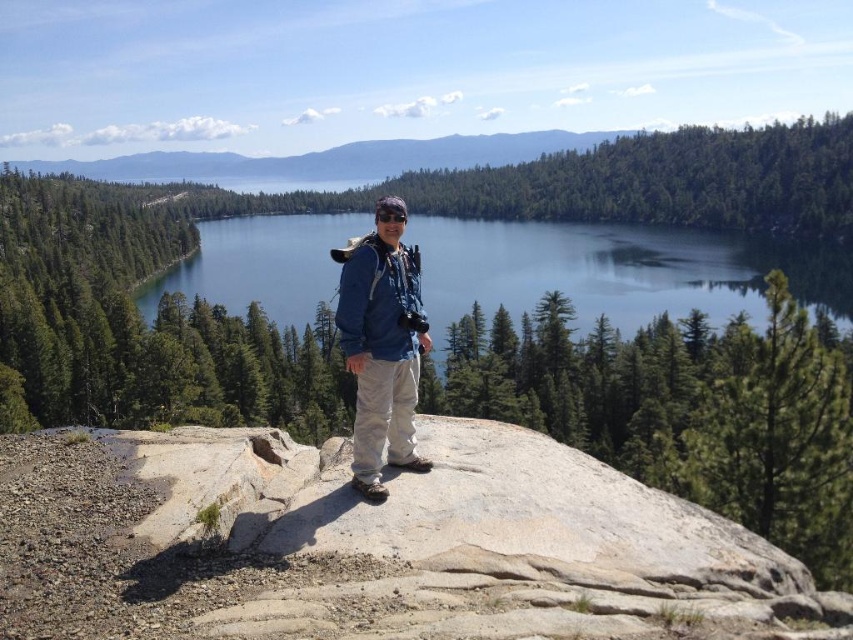
Question: Which of the following is the closest to the observer?

Choices:
 (A) gray granite rock at center
 (B) blue glassy water at center
 (C) blue denim jacket at center

Answer: (A)

Question: Does gray granite rock at center have a larger size compared to blue glassy water at center?

Choices:
 (A) no
 (B) yes

Answer: (A)

Question: Based on their relative distances, which object is nearer to the blue glassy water at center?

Choices:
 (A) gray granite rock at center
 (B) blue denim jacket at center

Answer: (A)

Question: Is blue glassy water at center wider than blue denim jacket at center?

Choices:
 (A) no
 (B) yes

Answer: (B)

Question: Can you confirm if gray granite rock at center is thinner than blue denim jacket at center?

Choices:
 (A) yes
 (B) no

Answer: (B)

Question: Considering the real-world distances, which object is farthest from the gray granite rock at center?

Choices:
 (A) blue denim jacket at center
 (B) blue glassy water at center

Answer: (B)